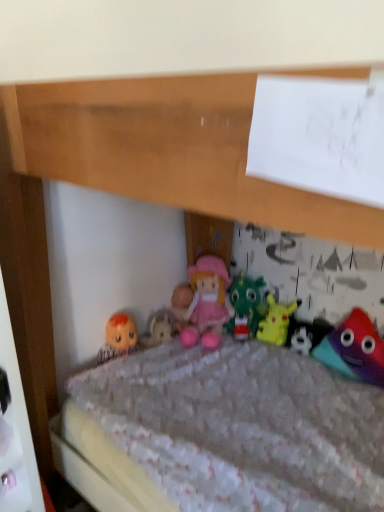
Question: Is pink fabric doll at center, placed as the fourth toy when sorted from right to left, bigger or smaller than white plush toy at center, the 3th toy when ordered from left to right?

Choices:
 (A) big
 (B) small

Answer: (A)

Question: Considering the positions of point (238, 335) and point (327, 330), is point (238, 335) closer or farther from the camera than point (327, 330)?

Choices:
 (A) farther
 (B) closer

Answer: (A)

Question: Estimate the real-world distances between objects in this image. Which object is closer to the multicolored plush toy at lower right, arranged as the fourth toy when viewed from the left?

Choices:
 (A) pink fabric doll at center, placed as the fourth toy when sorted from right to left
 (B) white plush toy at center, placed as the 2th toy when sorted from right to left
 (C) yellow plush toy at center, the 2th toy positioned from the left
 (D) pink fabric doll at center

Answer: (B)

Question: Which object is positioned farthest from the white plush toy at center, placed as the 2th toy when sorted from right to left?

Choices:
 (A) pink fabric doll at center
 (B) yellow plush toy at center, the third toy when ordered from right to left
 (C) pink fabric doll at center, positioned as the 1th toy in left-to-right order
 (D) multicolored plush toy at lower right, the first toy viewed from the right

Answer: (A)